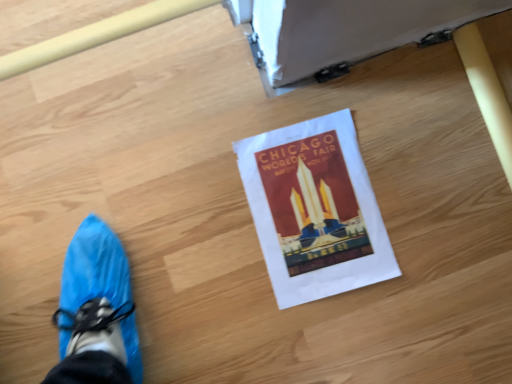
The height and width of the screenshot is (384, 512). What are the coordinates of `vacant space situated above matte paper poster at center (from a real-world perspective)` in the screenshot? It's located at (320, 203).